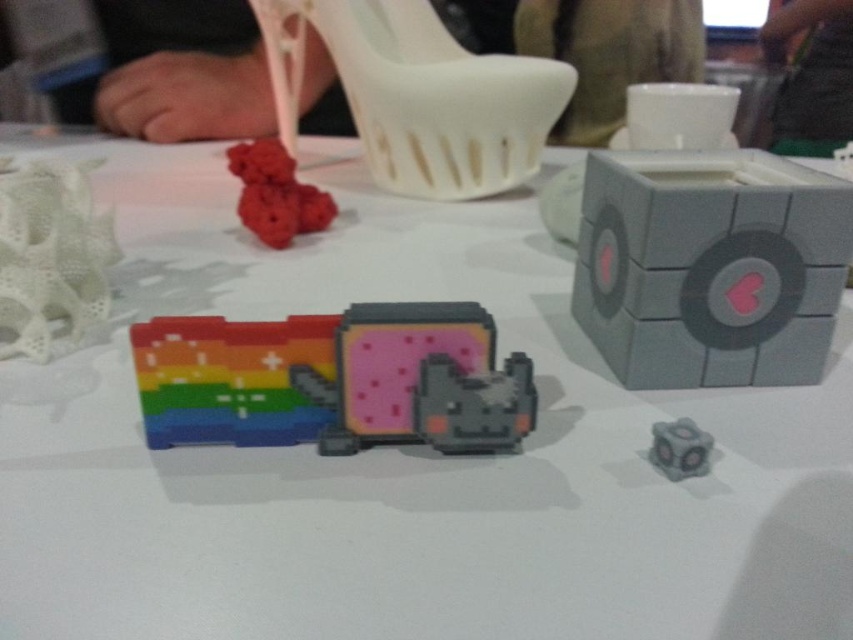
Describe the element at coordinates (334, 380) in the screenshot. I see `pixelated plastic toy at center` at that location.

What do you see at coordinates (334, 380) in the screenshot? I see `pixelated plastic toy at center` at bounding box center [334, 380].

Locate an element on the screen. This screenshot has height=640, width=853. pixelated plastic toy at center is located at coordinates [x=334, y=380].

Between point (595, 324) and point (688, 429), which one is positioned behind?

The point (595, 324) is behind.

Between point (714, 260) and point (677, 477), which one is positioned in front?

Positioned in front is point (677, 477).

Find the location of a particular element. This screenshot has width=853, height=640. gray matte cube at center right is located at coordinates (711, 268).

Identify the location of white matte shoe at upper center. (418, 93).

Between white matte shoe at upper center and rubber-like red cube at upper center, which one appears on the left side from the viewer's perspective?

Positioned to the left is rubber-like red cube at upper center.

Is point (415, 70) positioned behind point (308, 216)?

Yes, point (415, 70) is farther from viewer.

The image size is (853, 640). I want to click on white matte shoe at upper center, so 418,93.